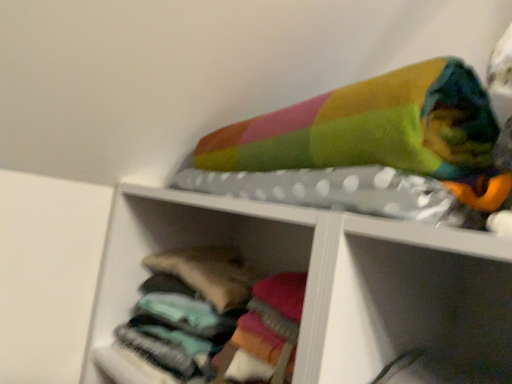
Question: Should I look upward or downward to see soft cotton socks at lower left?

Choices:
 (A) up
 (B) down

Answer: (B)